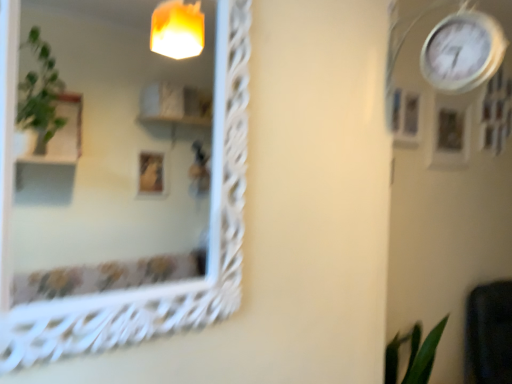
Question: Is white metallic clock at upper right in contact with wooden picture frame at upper right, the 2th picture frame positioned from the left?

Choices:
 (A) yes
 (B) no

Answer: (B)

Question: Could you tell me if white metallic clock at upper right is turned towards wooden picture frame at upper right, which is the first picture frame from back to front?

Choices:
 (A) no
 (B) yes

Answer: (A)

Question: From a real-world perspective, is white metallic clock at upper right below wooden picture frame at upper right, which is the first picture frame from back to front?

Choices:
 (A) no
 (B) yes

Answer: (A)

Question: Is white metallic clock at upper right further to camera compared to wooden picture frame at upper right, which is the first picture frame from back to front?

Choices:
 (A) yes
 (B) no

Answer: (B)

Question: Is wooden picture frame at upper right, which appears as the second picture frame when viewed from the front, inside white metallic clock at upper right?

Choices:
 (A) no
 (B) yes

Answer: (A)

Question: Considering the relative positions of white metallic clock at upper right and wooden picture frame at upper right, the 2th picture frame positioned from the left, in the image provided, is white metallic clock at upper right to the right of wooden picture frame at upper right, the 2th picture frame positioned from the left, from the viewer's perspective?

Choices:
 (A) no
 (B) yes

Answer: (A)

Question: From the image's perspective, is white textured mirror at upper left located beneath wooden picture frame at upper right, which appears as the second picture frame when viewed from the front?

Choices:
 (A) yes
 (B) no

Answer: (A)

Question: Would you say wooden picture frame at upper right, which is the first picture frame from back to front, is part of white textured mirror at upper left's contents?

Choices:
 (A) yes
 (B) no

Answer: (B)

Question: Can you confirm if white textured mirror at upper left is positioned to the right of wooden picture frame at upper right, the 2th picture frame positioned from the left?

Choices:
 (A) no
 (B) yes

Answer: (A)

Question: Does white textured mirror at upper left lie in front of wooden picture frame at upper right, the 2th picture frame positioned from the left?

Choices:
 (A) yes
 (B) no

Answer: (A)

Question: Is white textured mirror at upper left next to wooden picture frame at upper right, which appears as the second picture frame when viewed from the front?

Choices:
 (A) no
 (B) yes

Answer: (A)

Question: Does white textured mirror at upper left have a lesser height compared to wooden picture frame at upper right, which appears as the second picture frame when viewed from the front?

Choices:
 (A) no
 (B) yes

Answer: (A)

Question: Could you tell me if wooden picture frame at upper right, which appears as the second picture frame when viewed from the front, is turned towards matte white picture frame at upper right, which is the first picture frame from front to back?

Choices:
 (A) no
 (B) yes

Answer: (A)